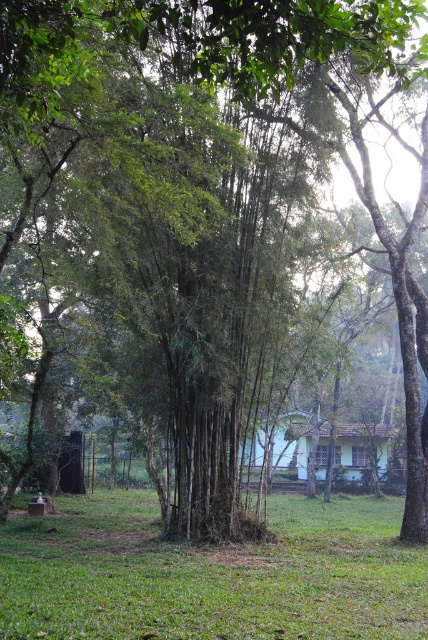
Based on the photo, you are standing in the middle of the bamboo forest looking at the green grassy area at lower center. What is the exact coordinate of the green grassy at lower center?

The green grassy at lower center is located at point (211, 573).